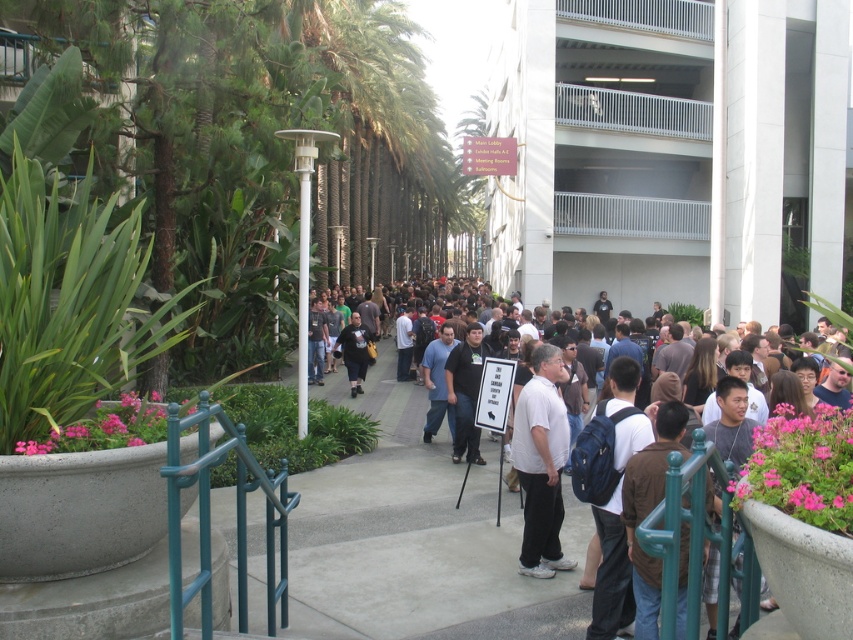
Does point (793, 468) come behind point (94, 435)?

That is False.

How distant is pink floral arrangement at lower right from pink fabric flower at lower left?

A distance of 3.34 meters exists between pink floral arrangement at lower right and pink fabric flower at lower left.

Where is `pink floral arrangement at lower right`? Image resolution: width=853 pixels, height=640 pixels. pink floral arrangement at lower right is located at coordinates (802, 467).

Is dark gray shirt at center shorter than matte black shirt at center?

Yes, dark gray shirt at center is shorter than matte black shirt at center.

Does point (479, 595) come closer to viewer compared to point (341, 336)?

Yes, point (479, 595) is in front of point (341, 336).

Who is more distant from viewer, (473, 499) or (351, 387)?

Point (351, 387)

This screenshot has width=853, height=640. In order to click on dark gray shirt at center in this screenshot , I will do `click(421, 536)`.

Is brown fabric shirt at center-right taller than matte black shirt at center?

No, brown fabric shirt at center-right is not taller than matte black shirt at center.

Locate an element on the screen. The height and width of the screenshot is (640, 853). brown fabric shirt at center-right is located at coordinates [x=648, y=509].